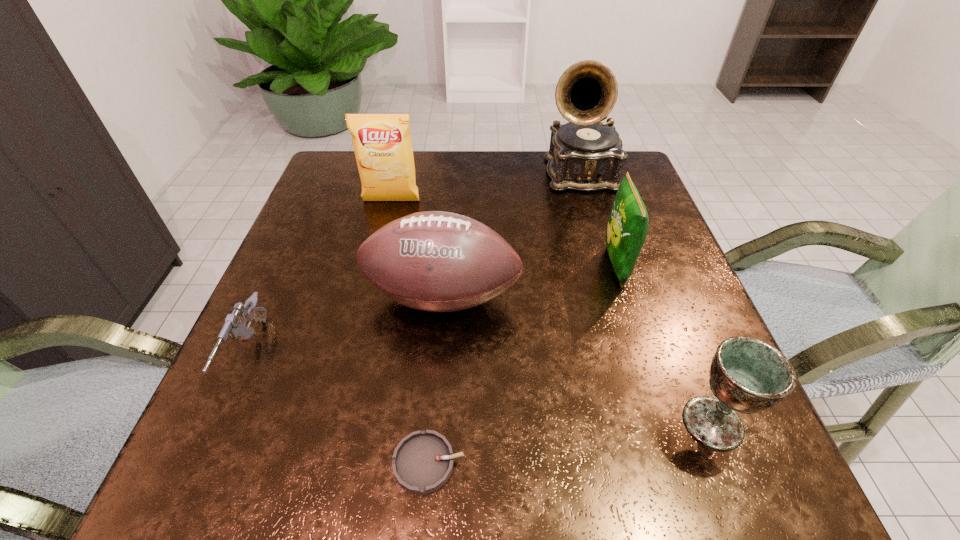
Locate an element on the screen. The height and width of the screenshot is (540, 960). free space between the shorter crisp (potato chip) and the taller crisp (potato chip) is located at coordinates (504, 233).

You are a GUI agent. You are given a task and a screenshot of the screen. Output one action in this format:
    pyautogui.click(x=<x>, y=<y>)
    Task: Click on the free space between the left crisp (potato chip) and the shorter crisp (potato chip)
    
    Given the screenshot: What is the action you would take?
    pyautogui.click(x=504, y=233)

Locate an element on the screen. The image size is (960, 540). free point between the chalice and the gun is located at coordinates (481, 389).

Image resolution: width=960 pixels, height=540 pixels. In order to click on empty space that is in between the phonograph record and the farther crisp (potato chip) in this screenshot , I will do `click(485, 188)`.

Identify the location of free area in between the nearer crisp (potato chip) and the farther crisp (potato chip). The width and height of the screenshot is (960, 540). (504, 233).

Locate which object ranks sixth in proximity to the right crisp (potato chip). Please provide its 2D coordinates. Your answer should be formatted as a tuple, i.e. [(x, y)], where the tuple contains the x and y coordinates of a point satisfying the conditions above.

[(235, 324)]

This screenshot has height=540, width=960. In order to click on object that stands as the third closest to the gun in this screenshot , I will do `click(382, 143)`.

The height and width of the screenshot is (540, 960). Find the location of `free space that satisfies the following two spatial constraints: 1. on the front of the left crisp (potato chip) with the logo; 2. on the left side of the chalice`. free space that satisfies the following two spatial constraints: 1. on the front of the left crisp (potato chip) with the logo; 2. on the left side of the chalice is located at coordinates (338, 423).

The width and height of the screenshot is (960, 540). I want to click on blank space that satisfies the following two spatial constraints: 1. at the barrel of the second shortest object; 2. on the left side of the ashtray, so click(x=201, y=463).

At what (x,y) coordinates should I click in order to perform the action: click on vacant point that satisfies the following two spatial constraints: 1. on the horn of the phonograph record; 2. on the left side of the chalice. Please return your answer as a coordinate pair (x, y). This screenshot has height=540, width=960. Looking at the image, I should click on (651, 423).